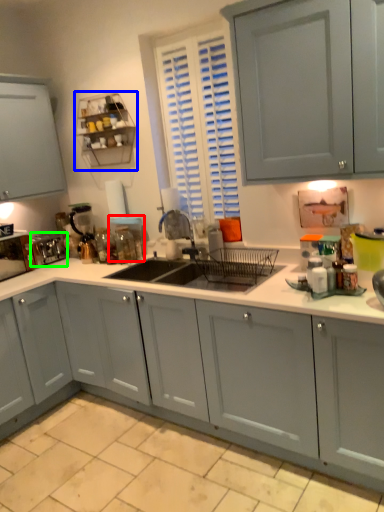
Question: Which object is positioned closest to appliance (highlighted by a red box)? Select from shelf (highlighted by a blue box) and appliance (highlighted by a green box).

Choices:
 (A) shelf
 (B) appliance

Answer: (A)